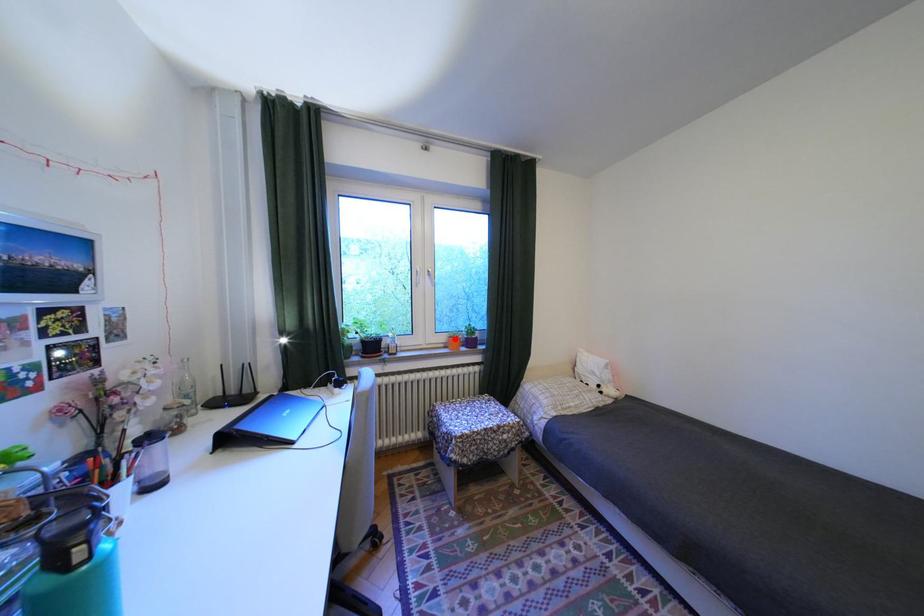
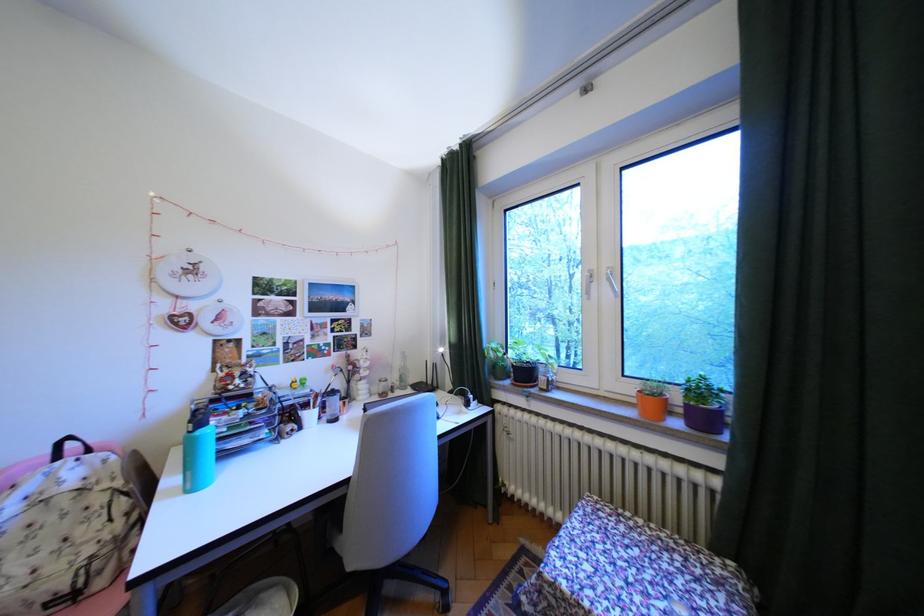
Locate, in the second image, the point that corresponds to the highlighted location in the first image.

(641, 390)